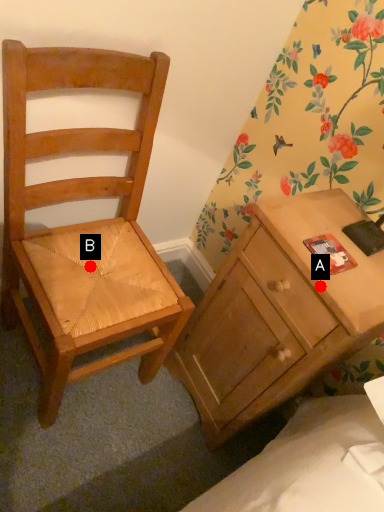
Question: Two points are circled on the image, labeled by A and B beside each circle. Which of the following is the farthest from the observer?

Choices:
 (A) A is further
 (B) B is further

Answer: (B)